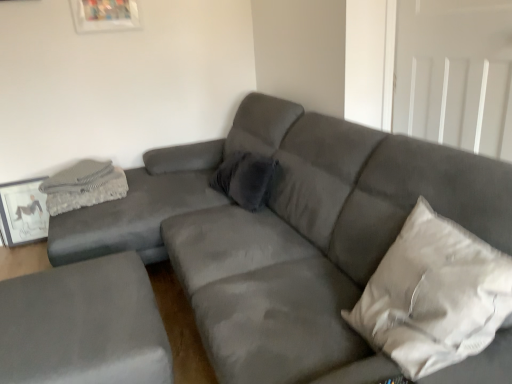
Question: Is matte gray picture frame at left located within suede gray ottoman at lower left, marked as the 2th studio couch in a right-to-left arrangement?

Choices:
 (A) no
 (B) yes

Answer: (A)

Question: Is suede gray ottoman at lower left, the 1th studio couch viewed from the left, oriented away from matte gray picture frame at left?

Choices:
 (A) yes
 (B) no

Answer: (B)

Question: Is suede gray ottoman at lower left, the 1th studio couch viewed from the left, placed right next to matte gray picture frame at left?

Choices:
 (A) no
 (B) yes

Answer: (A)

Question: Could you tell me if suede gray ottoman at lower left, the 1th studio couch viewed from the left, is facing matte gray picture frame at left?

Choices:
 (A) yes
 (B) no

Answer: (B)

Question: Can you confirm if suede gray ottoman at lower left, marked as the 2th studio couch in a right-to-left arrangement, is shorter than matte gray picture frame at left?

Choices:
 (A) yes
 (B) no

Answer: (A)

Question: Considering their positions, is matte gray picture frame at left located in front of or behind gray textured blanket at upper left?

Choices:
 (A) front
 (B) behind

Answer: (B)

Question: Is matte gray picture frame at left wider or thinner than gray textured blanket at upper left?

Choices:
 (A) wide
 (B) thin

Answer: (B)

Question: From the image's perspective, is matte gray picture frame at left above or below gray textured blanket at upper left?

Choices:
 (A) below
 (B) above

Answer: (A)

Question: Is matte gray picture frame at left bigger or smaller than gray textured blanket at upper left?

Choices:
 (A) small
 (B) big

Answer: (A)

Question: In terms of width, does matte gray picture frame at left look wider or thinner when compared to white fabric pillow at right, the 2th pillow from the left?

Choices:
 (A) wide
 (B) thin

Answer: (B)

Question: Is matte gray picture frame at left spatially inside white fabric pillow at right, the second pillow positioned from the back, or outside of it?

Choices:
 (A) inside
 (B) outside

Answer: (B)

Question: Looking at the image, does matte gray picture frame at left seem bigger or smaller compared to white fabric pillow at right, the 2th pillow from the left?

Choices:
 (A) small
 (B) big

Answer: (A)

Question: Is matte gray picture frame at left in front of or behind white fabric pillow at right, the first pillow when ordered from right to left, in the image?

Choices:
 (A) behind
 (B) front

Answer: (A)

Question: Is point (420, 327) positioned closer to the camera than point (108, 196)?

Choices:
 (A) closer
 (B) farther

Answer: (A)

Question: Visually, is white fabric pillow at right, the 1th pillow from the front, positioned to the left or to the right of gray textured blanket at upper left?

Choices:
 (A) left
 (B) right

Answer: (B)